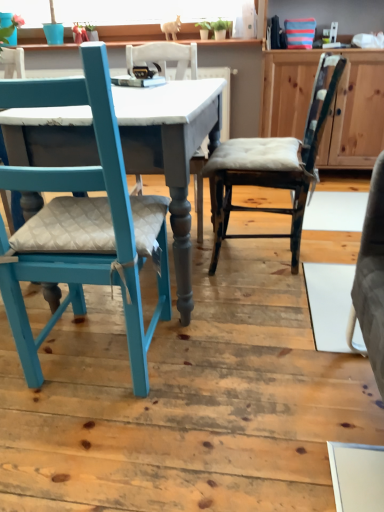
Question: Considering the positions of teal painted wood chair at left, marked as the 2th chair in a right-to-left arrangement, and distressed wood chair at center, positioned as the second chair in left-to-right order, in the image, is teal painted wood chair at left, marked as the 2th chair in a right-to-left arrangement, bigger or smaller than distressed wood chair at center, positioned as the second chair in left-to-right order,?

Choices:
 (A) small
 (B) big

Answer: (B)

Question: From the image's perspective, relative to distressed wood chair at center, which appears as the first chair when viewed from the right, is teal painted wood chair at left, marked as the 2th chair in a right-to-left arrangement, above or below?

Choices:
 (A) above
 (B) below

Answer: (B)

Question: Considering the real-world distances, which object is closest to the teal painted wood chair at left, marked as the 2th chair in a right-to-left arrangement?

Choices:
 (A) wooden cabinet at center
 (B) matte gray table at center
 (C) distressed wood chair at center, positioned as the second chair in left-to-right order

Answer: (B)

Question: Which is farther from the distressed wood chair at center, which appears as the first chair when viewed from the right?

Choices:
 (A) matte gray table at center
 (B) wooden cabinet at center
 (C) teal painted wood chair at left, acting as the 1th chair starting from the left

Answer: (B)